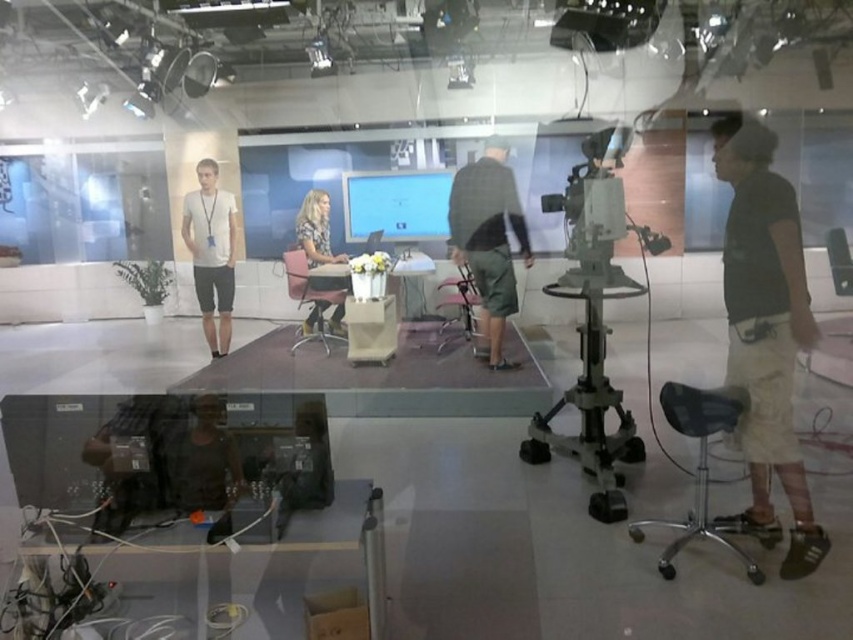
Looking at this image, can you confirm if black cotton shirt at right is positioned to the right of black plastic projector at upper center?

Correct, you'll find black cotton shirt at right to the right of black plastic projector at upper center.

Is black cotton shirt at right further to the viewer compared to black plastic projector at upper center?

No, it is not.

The image size is (853, 640). Find the location of `black cotton shirt at right`. black cotton shirt at right is located at coordinates (766, 330).

Does point (804, 481) come behind point (213, 333)?

No, it is not.

The height and width of the screenshot is (640, 853). Describe the element at coordinates (766, 330) in the screenshot. I see `black cotton shirt at right` at that location.

Locate an element on the screen. black cotton shirt at right is located at coordinates [766, 330].

Can you confirm if black plastic stool at lower right is wider than patterned fabric blouse at center?

Yes, black plastic stool at lower right is wider than patterned fabric blouse at center.

Measure the distance between point (703,438) and camera.

Point (703,438) and camera are 8.63 feet apart.

Looking at this image, who is more distant from viewer, (717, 408) or (309, 266)?

The point (309, 266) is more distant.

Find the location of a particular element. black plastic stool at lower right is located at coordinates (701, 472).